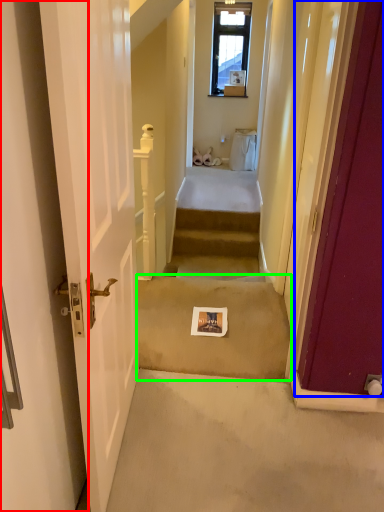
Question: Which is farther away from door (highlighted by a red box)? door (highlighted by a blue box) or concrete (highlighted by a green box)?

Choices:
 (A) door
 (B) concrete

Answer: (B)